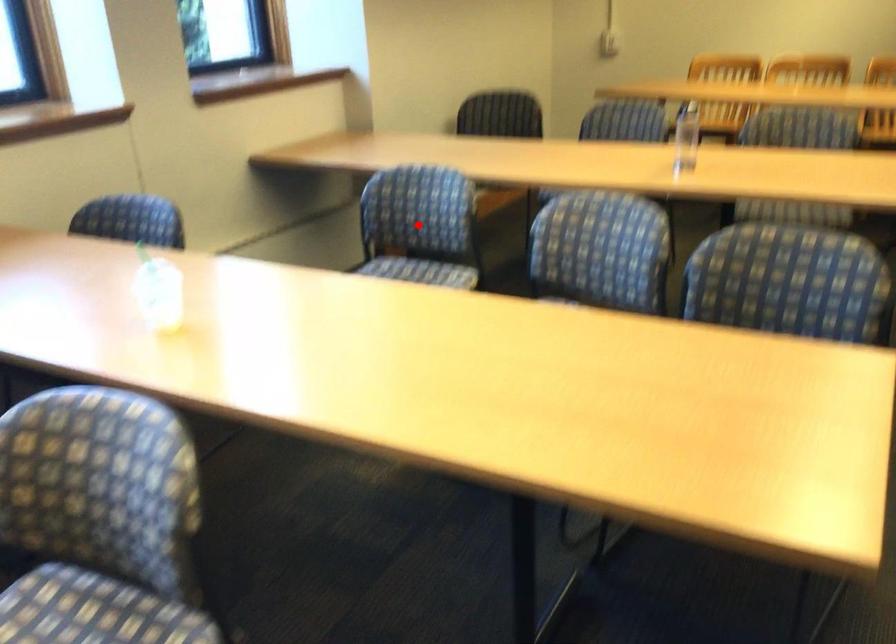
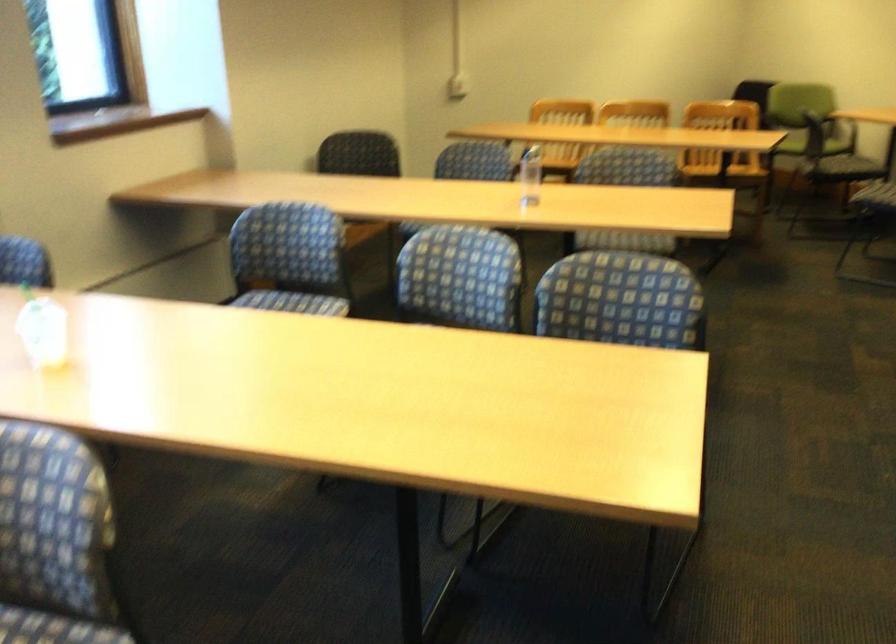
In the second image, find the point that corresponds to the highlighted location in the first image.

(289, 259)